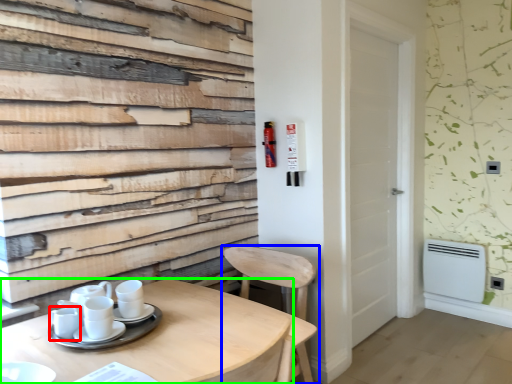
Question: Estimate the real-world distances between objects in this image. Which object is closer to tableware (highlighted by a red box), chair (highlighted by a blue box) or table (highlighted by a green box)?

Choices:
 (A) chair
 (B) table

Answer: (B)